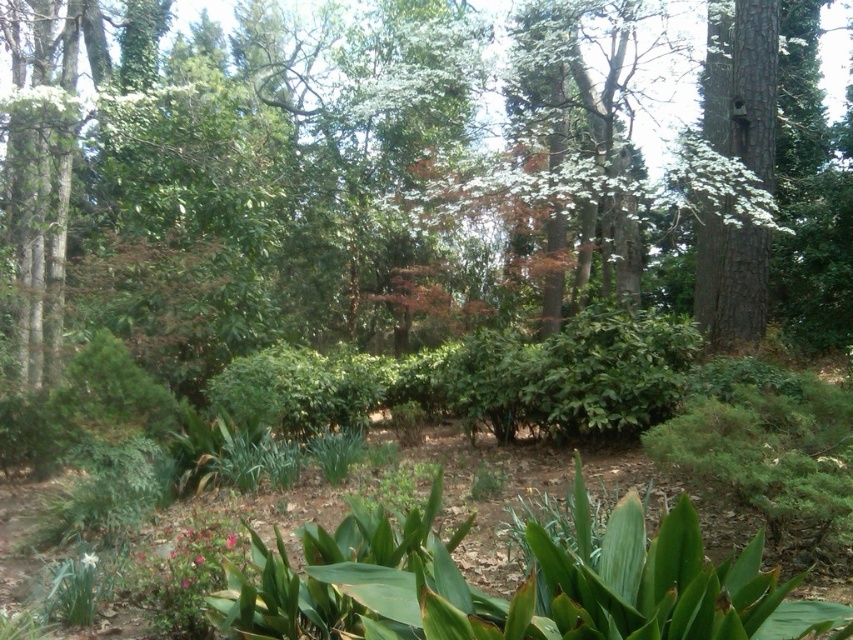
Does point (724, 273) come behind point (225, 544)?

Yes, it is.

Is point (747, 116) farther from camera compared to point (225, 547)?

Yes, it is.

You are a GUI agent. You are given a task and a screenshot of the screen. Output one action in this format:
    pyautogui.click(x=<x>, y=<y>)
    Task: Click on the brown rough bark tree at upper right
    The image size is (853, 640).
    Given the screenshot: What is the action you would take?
    tap(743, 84)

Does brown rough bark tree at upper right have a greater height compared to green matte flower at lower left?

Yes.

Is point (735, 321) less distant than point (96, 560)?

No, it is not.

Is point (730, 250) behind point (88, 564)?

Yes.

Locate an element on the screen. brown rough bark tree at upper right is located at coordinates (743, 84).

Is pink matte flower at lower left wider than green matte flower at lower left?

Yes.

Is pink matte flower at lower left to the left of green matte flower at lower left from the viewer's perspective?

No, pink matte flower at lower left is not to the left of green matte flower at lower left.

You are a GUI agent. You are given a task and a screenshot of the screen. Output one action in this format:
    pyautogui.click(x=<x>, y=<y>)
    Task: Click on the pink matte flower at lower left
    
    Given the screenshot: What is the action you would take?
    pyautogui.click(x=196, y=560)